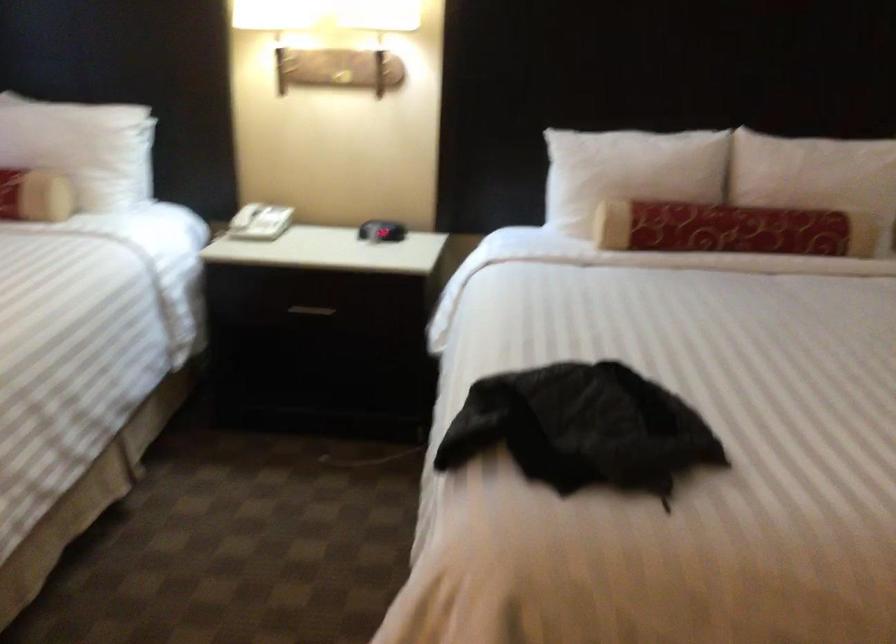
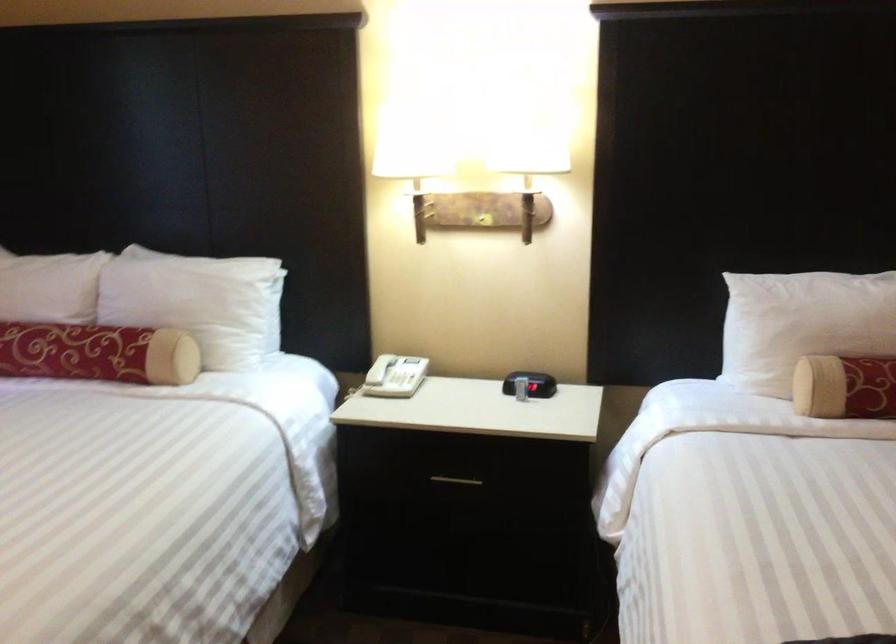
The point at (627, 225) is marked in the first image. Where is the corresponding point in the second image?

(845, 386)